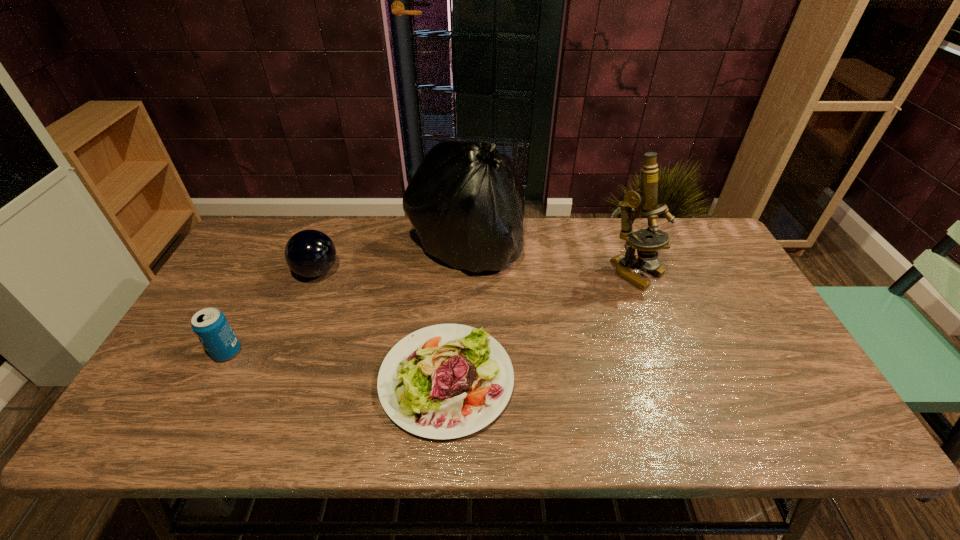
At what (x,y) coordinates should I click in order to perform the action: click on vacant area at the near left corner. Please return your answer as a coordinate pair (x, y). This screenshot has width=960, height=540. Looking at the image, I should click on (126, 428).

Find the location of `free space between the plastic bag and the salad plate`. free space between the plastic bag and the salad plate is located at coordinates (456, 314).

In order to click on vacant space in between the soda can and the plastic bag in this screenshot , I will do `click(347, 300)`.

Identify the location of unoccupied position between the soda can and the bowling ball. (272, 312).

You are a GUI agent. You are given a task and a screenshot of the screen. Output one action in this format:
    pyautogui.click(x=<x>, y=<y>)
    Task: Click on the vacant space that's between the plastic bag and the bowling ball
    This screenshot has width=960, height=540.
    Given the screenshot: What is the action you would take?
    [x=392, y=260]

Find the location of a particular element. free space between the soda can and the salad plate is located at coordinates (337, 366).

What are the coordinates of `free space between the plastic bag and the leftmost object` in the screenshot? It's located at (347, 300).

Locate an element on the screen. The height and width of the screenshot is (540, 960). unoccupied position between the salad plate and the plastic bag is located at coordinates (456, 314).

Where is `vacant region between the leftmost object and the microscope`? vacant region between the leftmost object and the microscope is located at coordinates (431, 312).

Locate an element on the screen. free space between the soda can and the fourth object from right to left is located at coordinates (272, 312).